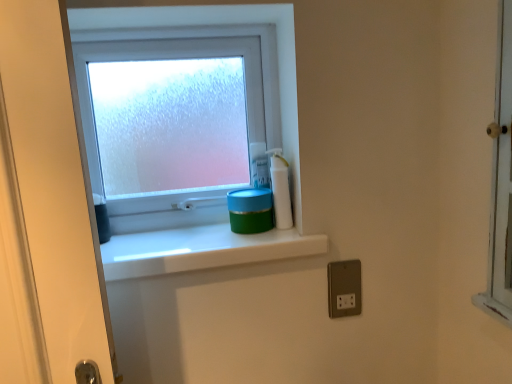
I want to click on white glossy bottle at upper right, so click(x=280, y=189).

The image size is (512, 384). What are the coordinates of `blue plastic container at upper right` in the screenshot? It's located at (259, 165).

You are a GUI agent. You are given a task and a screenshot of the screen. Output one action in this format:
    pyautogui.click(x=<x>, y=<y>)
    Task: Click on the white glossy bottle at upper right
    This screenshot has width=512, height=384.
    Given the screenshot: What is the action you would take?
    pyautogui.click(x=280, y=189)

Considering the relative positions of satin silver outlet at lower right and blue plastic container at upper right in the image provided, is satin silver outlet at lower right to the left or to the right of blue plastic container at upper right?

Clearly, satin silver outlet at lower right is on the right of blue plastic container at upper right in the image.

From a real-world perspective, which object rests below the other?

satin silver outlet at lower right, from a real-world perspective.

Is satin silver outlet at lower right next to blue plastic container at upper right and touching it?

No, satin silver outlet at lower right is not making contact with blue plastic container at upper right.

Can you confirm if satin silver outlet at lower right is wider than blue plastic container at upper right?

Incorrect, the width of satin silver outlet at lower right does not surpass that of blue plastic container at upper right.

Is point (113, 261) positioned behind point (344, 273)?

No, (113, 261) is in front of (344, 273).

Is green matte container at center not near satin silver outlet at lower right?

No.

Locate an element on the screen. The image size is (512, 384). electric outlet that appears below the green matte container at center (from the image's perspective) is located at coordinates (344, 288).

Considering the sizes of white glossy bottle at upper right and green matte container at center in the image, is white glossy bottle at upper right wider or thinner than green matte container at center?

Considering their sizes, white glossy bottle at upper right looks slimmer than green matte container at center.

From the image's perspective, which one is positioned lower, white glossy bottle at upper right or green matte container at center?

green matte container at center, from the image's perspective.

Is white glossy bottle at upper right beside green matte container at center?

white glossy bottle at upper right and green matte container at center are clearly separated.

Which object is more forward, white glossy bottle at upper right or green matte container at center?

green matte container at center.

In terms of width, does frosted glass window at upper center look wider or thinner when compared to blue plastic container at upper right?

Considering their sizes, frosted glass window at upper center looks slimmer than blue plastic container at upper right.

Would you consider frosted glass window at upper center to be distant from blue plastic container at upper right?

No, frosted glass window at upper center is in close proximity to blue plastic container at upper right.

Does frosted glass window at upper center lie behind blue plastic container at upper right?

That is False.

Does frosted glass window at upper center have a lesser height compared to blue plastic container at upper right?

Incorrect, the height of frosted glass window at upper center does not fall short of that of blue plastic container at upper right.

From the image's perspective, is satin silver outlet at lower right below green matte container at center?

Correct, satin silver outlet at lower right appears lower than green matte container at center in the image.

Would you consider satin silver outlet at lower right to be distant from green matte container at center?

No, there isn't a large distance between satin silver outlet at lower right and green matte container at center.

Based on the photo, which object is further away from the camera taking this photo, satin silver outlet at lower right or green matte container at center?

satin silver outlet at lower right is further away from the camera.

Which object is positioned more to the right, satin silver outlet at lower right or green matte container at center?

Positioned to the right is satin silver outlet at lower right.

You are a GUI agent. You are given a task and a screenshot of the screen. Output one action in this format:
    pyautogui.click(x=<x>, y=<y>)
    Task: Click on the window that appears on the left of satin silver outlet at lower right
    The width and height of the screenshot is (512, 384).
    Given the screenshot: What is the action you would take?
    pyautogui.click(x=209, y=35)

Who is bigger, satin silver outlet at lower right or frosted glass window at upper center?

With larger size is frosted glass window at upper center.

Which is behind, satin silver outlet at lower right or frosted glass window at upper center?

frosted glass window at upper center is more distant.

From a real-world perspective, is satin silver outlet at lower right positioned over frosted glass window at upper center based on gravity?

No, from a real-world perspective, satin silver outlet at lower right is not above frosted glass window at upper center.

Could white glossy bottle at upper right be considered to be inside frosted glass window at upper center?

No, white glossy bottle at upper right is not surrounded by frosted glass window at upper center.

From a real-world perspective, which object rests below the other?

white glossy bottle at upper right.

Can you confirm if frosted glass window at upper center is wider than white glossy bottle at upper right?

Correct, the width of frosted glass window at upper center exceeds that of white glossy bottle at upper right.

In order to click on electric outlet lying on the right of blue plastic container at upper right in this screenshot , I will do (x=344, y=288).

Image resolution: width=512 pixels, height=384 pixels. In order to click on electric outlet beneath the green matte container at center (from a real-world perspective) in this screenshot , I will do `click(344, 288)`.

When comparing their distances from satin silver outlet at lower right, does frosted glass window at upper center or white glossy bottle at upper right seem further?

frosted glass window at upper center lies further to satin silver outlet at lower right than the other object.

Based on their spatial positions, is frosted glass window at upper center or satin silver outlet at lower right further from white glossy bottle at upper right?

Based on the image, frosted glass window at upper center appears to be further to white glossy bottle at upper right.

Looking at the image, which one is located closer to green matte container at center, blue plastic container at upper right or satin silver outlet at lower right?

blue plastic container at upper right lies closer to green matte container at center than the other object.

When comparing their distances from green matte container at center, does blue plastic container at upper right or white glossy bottle at upper right seem closer?

Based on the image, white glossy bottle at upper right appears to be nearer to green matte container at center.

Considering their positions, is blue plastic container at upper right positioned further to green matte container at center than frosted glass window at upper center?

frosted glass window at upper center is further to green matte container at center.

When comparing their distances from frosted glass window at upper center, does satin silver outlet at lower right or white glossy bottle at upper right seem further?

The object further to frosted glass window at upper center is satin silver outlet at lower right.

When comparing their distances from green matte container at center, does satin silver outlet at lower right or frosted glass window at upper center seem closer?

The object closer to green matte container at center is satin silver outlet at lower right.

Which object lies nearer to the anchor point green matte container at center, white glossy bottle at upper right or frosted glass window at upper center?

Based on the image, white glossy bottle at upper right appears to be nearer to green matte container at center.

At what (x,y) coordinates should I click in order to perform the action: click on cleaning product positioned between green matte container at center and blue plastic container at upper right from near to far. Please return your answer as a coordinate pair (x, y). Image resolution: width=512 pixels, height=384 pixels. Looking at the image, I should click on (280, 189).

What are the coordinates of `toiletry between frosted glass window at upper center and green matte container at center from top to bottom` in the screenshot? It's located at (259, 165).

Where is `cleaning product between frosted glass window at upper center and satin silver outlet at lower right vertically`? The width and height of the screenshot is (512, 384). cleaning product between frosted glass window at upper center and satin silver outlet at lower right vertically is located at coordinates (280, 189).

The width and height of the screenshot is (512, 384). Find the location of `cleaning product located between green matte container at center and satin silver outlet at lower right in the left-right direction`. cleaning product located between green matte container at center and satin silver outlet at lower right in the left-right direction is located at coordinates (280, 189).